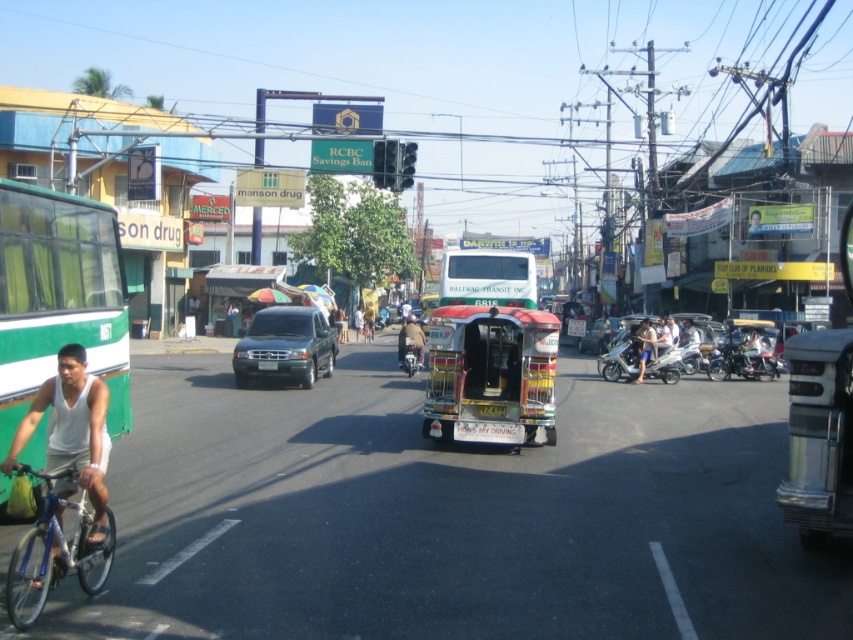
Question: Estimate the real-world distances between objects in this image. Which object is closer to the metallic silver motorcycle at center?

Choices:
 (A) white fabric shirt at lower left
 (B) green matte bus at left

Answer: (B)

Question: Which object is positioned closest to the brown leather jacket at center?

Choices:
 (A) metallic silver motorcycle at center-right
 (B) white fabric shirt at lower left
 (C) metallic green van at center
 (D) metallic silver scooter at center-right

Answer: (C)

Question: Can you confirm if metallic red and yellow tricycle at center is smaller than blue metallic bicycle at lower left?

Choices:
 (A) yes
 (B) no

Answer: (B)

Question: Does metallic silver scooter at center-right appear on the left side of metallic silver motorcycle at center-right?

Choices:
 (A) no
 (B) yes

Answer: (B)

Question: Among these points, which one is farthest from the camera?

Choices:
 (A) [x=401, y=326]
 (B) [x=415, y=342]
 (C) [x=10, y=600]

Answer: (A)

Question: Does metallic green van at center appear under metallic silver scooter at center-right?

Choices:
 (A) yes
 (B) no

Answer: (B)